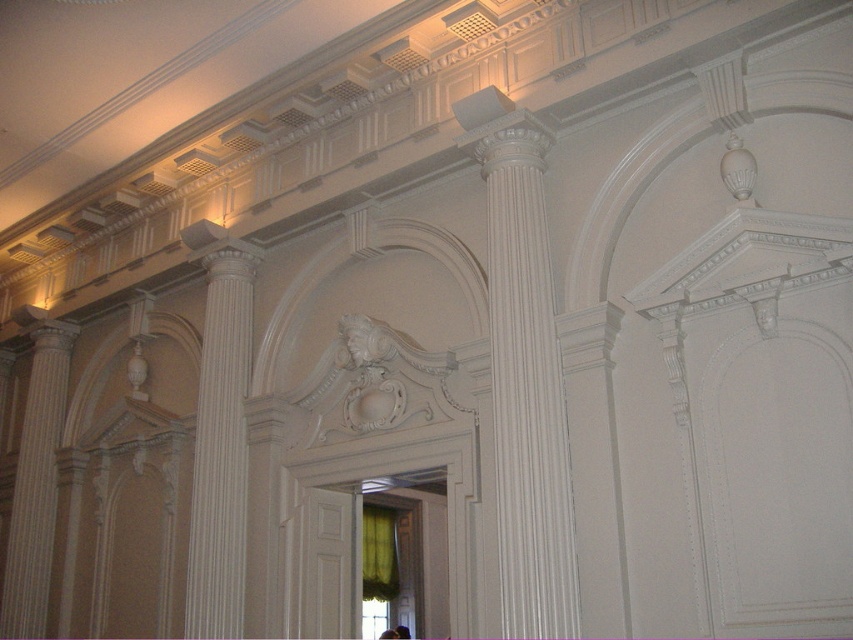
Between white glossy column at center and white smooth column at center, which one has less height?

With less height is white smooth column at center.

Is white glossy column at center taller than white smooth column at center?

Yes.

Does point (518, 236) lie in front of point (231, 250)?

Yes, point (518, 236) is in front of point (231, 250).

At what (x,y) coordinates should I click in order to perform the action: click on white glossy column at center. Please return your answer as a coordinate pair (x, y). The width and height of the screenshot is (853, 640). Looking at the image, I should click on (525, 385).

Can you confirm if white smooth column at center is positioned below white glossy column at left?

Actually, white smooth column at center is above white glossy column at left.

Who is more forward, (206, 632) or (4, 632)?

Point (206, 632)

Find the location of a particular element. Image resolution: width=853 pixels, height=640 pixels. white smooth column at center is located at coordinates (219, 449).

Does white glossy column at center come in front of white glossy column at left?

Yes, white glossy column at center is in front of white glossy column at left.

Describe the element at coordinates (525, 385) in the screenshot. This screenshot has width=853, height=640. I see `white glossy column at center` at that location.

Find the location of a particular element. Image resolution: width=853 pixels, height=640 pixels. white glossy column at center is located at coordinates (525, 385).